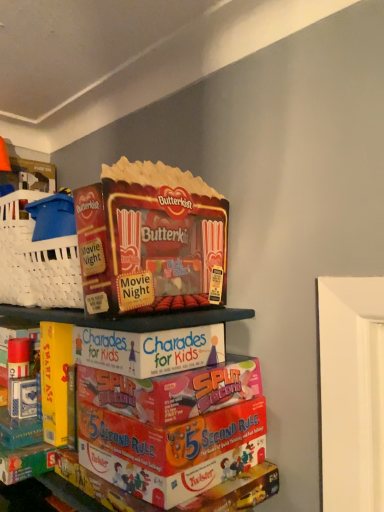
This screenshot has width=384, height=512. What do you see at coordinates (171, 446) in the screenshot? I see `cardboard game boxes at center` at bounding box center [171, 446].

You are a GUI agent. You are given a task and a screenshot of the screen. Output one action in this format:
    pyautogui.click(x=<x>, y=<y>)
    Task: Click on the cardboard game boxes at center
    
    Given the screenshot: What is the action you would take?
    pyautogui.click(x=171, y=446)

In order to face matte cardboard butterkist popcorn at upper center, should I rotate leftwards or rightwards?

It's best to rotate left around 4.376 degrees.

Where is `matte cardboard butterkist popcorn at upper center`? matte cardboard butterkist popcorn at upper center is located at coordinates (151, 240).

From the picture: What is the approximate width of matte cardboard butterkist popcorn at upper center?

14.16 inches.

This screenshot has height=512, width=384. Describe the element at coordinates (151, 240) in the screenshot. I see `matte cardboard butterkist popcorn at upper center` at that location.

Find the location of `cardboard game boxes at center`. cardboard game boxes at center is located at coordinates (171, 446).

Considering the relative positions of matte cardboard butterkist popcorn at upper center and cardboard game boxes at center in the image provided, is matte cardboard butterkist popcorn at upper center to the left or to the right of cardboard game boxes at center?

From the image, it's evident that matte cardboard butterkist popcorn at upper center is to the left of cardboard game boxes at center.

In the scene shown: Is matte cardboard butterkist popcorn at upper center positioned in front of cardboard game boxes at center?

No, matte cardboard butterkist popcorn at upper center is behind cardboard game boxes at center.

Considering the positions of point (191, 260) and point (99, 418), is point (191, 260) closer or farther from the camera than point (99, 418)?

Point (191, 260) appears to be farther away from the viewer than point (99, 418).

From the image's perspective, would you say matte cardboard butterkist popcorn at upper center is shown under cardboard game boxes at center?

No, from the image's perspective, matte cardboard butterkist popcorn at upper center is not beneath cardboard game boxes at center.

From a real-world perspective, is matte cardboard butterkist popcorn at upper center below cardboard game boxes at center?

No.

Which of these two, matte cardboard butterkist popcorn at upper center or cardboard game boxes at center, is thinner?

cardboard game boxes at center.

Which of these two, matte cardboard butterkist popcorn at upper center or cardboard game boxes at center, stands shorter?

matte cardboard butterkist popcorn at upper center is shorter.

Which of these two, matte cardboard butterkist popcorn at upper center or cardboard game boxes at center, is bigger?

Bigger between the two is cardboard game boxes at center.

Is matte cardboard butterkist popcorn at upper center surrounding cardboard game boxes at center?

No, matte cardboard butterkist popcorn at upper center does not contain cardboard game boxes at center.

Is matte cardboard butterkist popcorn at upper center in contact with cardboard game boxes at center?

No, matte cardboard butterkist popcorn at upper center is not touching cardboard game boxes at center.

Is matte cardboard butterkist popcorn at upper center oriented away from cardboard game boxes at center?

No, cardboard game boxes at center is not at the back of matte cardboard butterkist popcorn at upper center.

What's the angular difference between matte cardboard butterkist popcorn at upper center and cardboard game boxes at center's facing directions?

There is a 3.47-degree angle between the facing directions of matte cardboard butterkist popcorn at upper center and cardboard game boxes at center.

From the picture: How distant is matte cardboard butterkist popcorn at upper center from cardboard game boxes at center?

matte cardboard butterkist popcorn at upper center is 6.62 inches away from cardboard game boxes at center.

Where is `product located above the cardboard game boxes at center (from a real-world perspective)`? Image resolution: width=384 pixels, height=512 pixels. product located above the cardboard game boxes at center (from a real-world perspective) is located at coordinates (151, 240).

Which object is positioned more to the left, cardboard game boxes at center or matte cardboard butterkist popcorn at upper center?

A: Positioned to the left is matte cardboard butterkist popcorn at upper center.

Between cardboard game boxes at center and matte cardboard butterkist popcorn at upper center, which one is positioned behind?

matte cardboard butterkist popcorn at upper center is more distant.

Considering the positions of points (138, 319) and (142, 169), is point (138, 319) farther from camera compared to point (142, 169)?

No, (138, 319) is closer to viewer.

From the image's perspective, would you say cardboard game boxes at center is positioned over matte cardboard butterkist popcorn at upper center?

No, from the image's perspective, cardboard game boxes at center is not over matte cardboard butterkist popcorn at upper center.

From a real-world perspective, who is located lower, cardboard game boxes at center or matte cardboard butterkist popcorn at upper center?

cardboard game boxes at center.

Looking at their sizes, would you say cardboard game boxes at center is wider or thinner than matte cardboard butterkist popcorn at upper center?

In the image, cardboard game boxes at center appears to be more narrow than matte cardboard butterkist popcorn at upper center.

Is cardboard game boxes at center taller than matte cardboard butterkist popcorn at upper center?

Yes.

In terms of size, does cardboard game boxes at center appear bigger or smaller than matte cardboard butterkist popcorn at upper center?

In the image, cardboard game boxes at center appears to be larger than matte cardboard butterkist popcorn at upper center.

Is cardboard game boxes at center situated inside matte cardboard butterkist popcorn at upper center or outside?

cardboard game boxes at center cannot be found inside matte cardboard butterkist popcorn at upper center.

Is cardboard game boxes at center touching matte cardboard butterkist popcorn at upper center?

No, cardboard game boxes at center is not with matte cardboard butterkist popcorn at upper center.

Is cardboard game boxes at center oriented towards matte cardboard butterkist popcorn at upper center?

No.

How much distance is there between cardboard game boxes at center and matte cardboard butterkist popcorn at upper center?

cardboard game boxes at center is 6.62 inches away from matte cardboard butterkist popcorn at upper center.

In order to click on product to the left of cardboard game boxes at center in this screenshot , I will do `click(151, 240)`.

Find the location of a particular element. The height and width of the screenshot is (512, 384). shelf on the right of matte cardboard butterkist popcorn at upper center is located at coordinates (171, 446).

What are the coordinates of `product behind the cardboard game boxes at center` in the screenshot? It's located at [x=151, y=240].